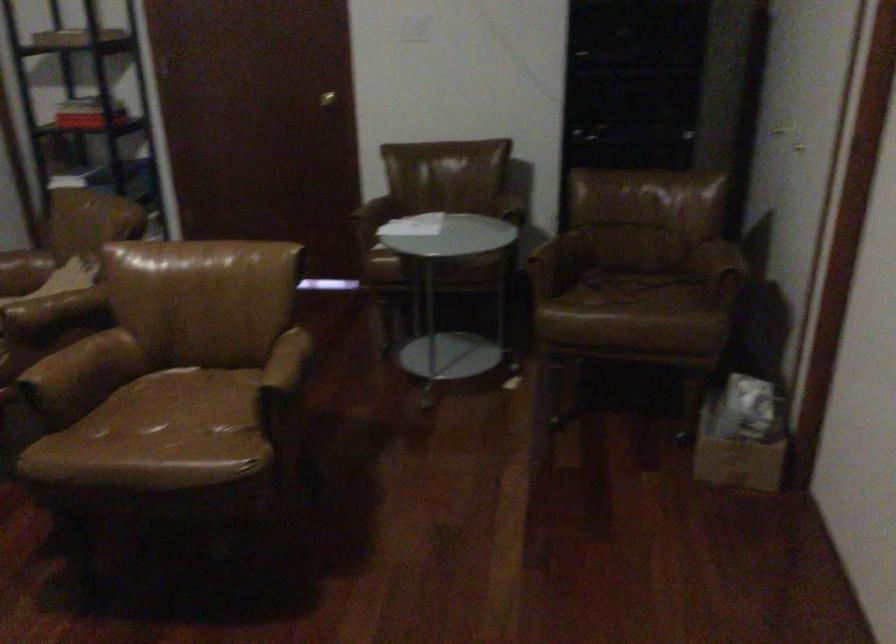
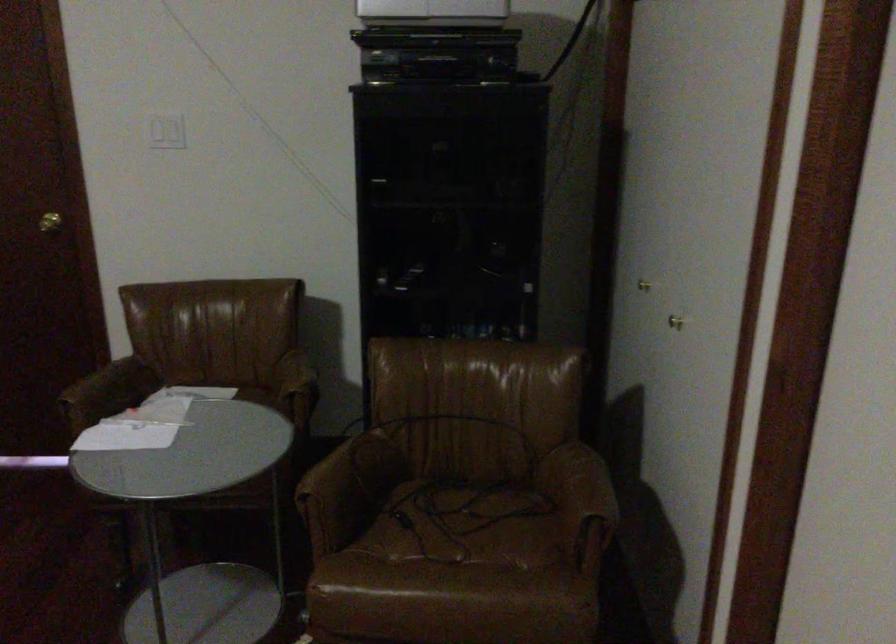
Where in the second image is the point corresponding to pixel 531 272 from the first image?

(312, 513)